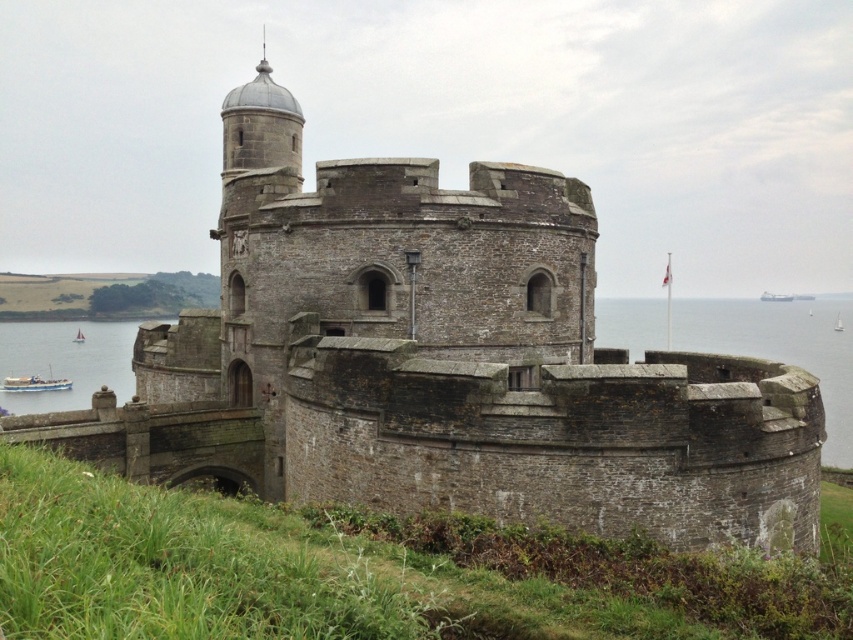
What do you see at coordinates (782, 348) in the screenshot? The width and height of the screenshot is (853, 640). I see `gray stone water at right` at bounding box center [782, 348].

Between gray stone water at right and white sailboat at lower left, which one appears on the right side from the viewer's perspective?

gray stone water at right is more to the right.

Is point (778, 352) behind point (82, 337)?

No, it is not.

The width and height of the screenshot is (853, 640). In order to click on gray stone water at right in this screenshot , I will do `click(782, 348)`.

Is blue water at lower left further to the viewer compared to white plastic boat at lower left?

No.

Does blue water at lower left have a lesser width compared to white plastic boat at lower left?

No, blue water at lower left is not thinner than white plastic boat at lower left.

Is point (132, 381) farther from camera compared to point (4, 385)?

No, it is not.

Identify the location of blue water at lower left. The height and width of the screenshot is (640, 853). (67, 362).

Does white plastic boat at lower left have a greater height compared to white sailboat at lower left?

Yes, white plastic boat at lower left is taller than white sailboat at lower left.

From the picture: Is white plastic boat at lower left behind white sailboat at lower left?

That is False.

Is point (27, 387) positioned in front of point (77, 330)?

Yes, point (27, 387) is in front of point (77, 330).

You are a GUI agent. You are given a task and a screenshot of the screen. Output one action in this format:
    pyautogui.click(x=<x>, y=<y>)
    Task: Click on the white plastic boat at lower left
    Image resolution: width=853 pixels, height=640 pixels.
    Given the screenshot: What is the action you would take?
    pyautogui.click(x=33, y=384)